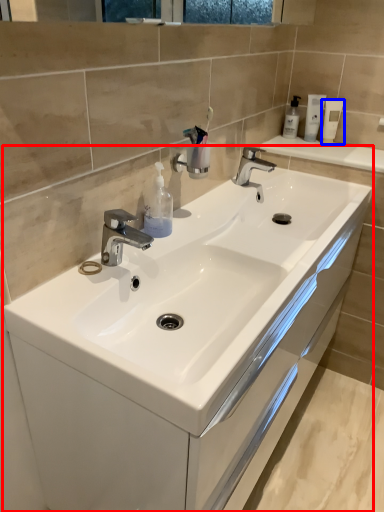
Question: Among these objects, which one is nearest to the camera, bathroom cabinet (highlighted by a red box) or mouthwash (highlighted by a blue box)?

Choices:
 (A) bathroom cabinet
 (B) mouthwash

Answer: (A)